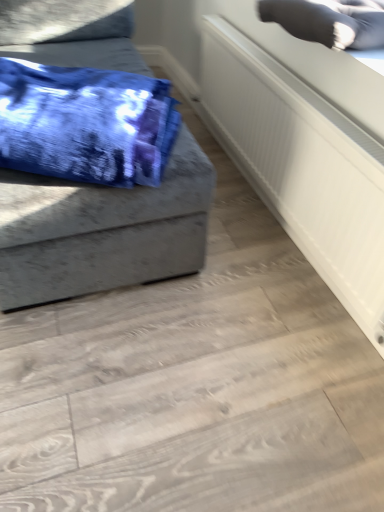
Question: Can you confirm if gray fabric pillow at upper right is bigger than white textured radiator at upper right?

Choices:
 (A) no
 (B) yes

Answer: (B)

Question: Considering the relative sizes of gray fabric pillow at upper right and white textured radiator at upper right in the image provided, is gray fabric pillow at upper right taller than white textured radiator at upper right?

Choices:
 (A) no
 (B) yes

Answer: (A)

Question: Can you confirm if gray fabric pillow at upper right is smaller than white textured radiator at upper right?

Choices:
 (A) no
 (B) yes

Answer: (A)

Question: From the image's perspective, would you say gray fabric pillow at upper right is positioned over white textured radiator at upper right?

Choices:
 (A) yes
 (B) no

Answer: (A)

Question: Is there a large distance between gray fabric pillow at upper right and white textured radiator at upper right?

Choices:
 (A) yes
 (B) no

Answer: (B)

Question: Is white textured radiator at upper right inside the boundaries of gray fabric pillow at upper right, or outside?

Choices:
 (A) outside
 (B) inside

Answer: (A)

Question: Is point (299, 147) positioned closer to the camera than point (286, 28)?

Choices:
 (A) farther
 (B) closer

Answer: (B)

Question: Visually, is white textured radiator at upper right positioned to the left or to the right of gray fabric pillow at upper right?

Choices:
 (A) right
 (B) left

Answer: (B)

Question: In terms of width, does white textured radiator at upper right look wider or thinner when compared to gray fabric pillow at upper right?

Choices:
 (A) wide
 (B) thin

Answer: (B)

Question: In the image, is gray fabric pillow at upper right on the left side or the right side of blue tie-dye fabric at left?

Choices:
 (A) right
 (B) left

Answer: (A)

Question: Is gray fabric pillow at upper right in front of or behind blue tie-dye fabric at left in the image?

Choices:
 (A) front
 (B) behind

Answer: (B)

Question: Is gray fabric pillow at upper right taller or shorter than blue tie-dye fabric at left?

Choices:
 (A) tall
 (B) short

Answer: (B)

Question: In terms of width, does gray fabric pillow at upper right look wider or thinner when compared to blue tie-dye fabric at left?

Choices:
 (A) wide
 (B) thin

Answer: (B)

Question: Would you say blue tie-dye fabric at left is inside or outside gray fabric pillow at upper right?

Choices:
 (A) outside
 (B) inside

Answer: (A)

Question: From a real-world perspective, is blue tie-dye fabric at left positioned above or below gray fabric pillow at upper right?

Choices:
 (A) below
 (B) above

Answer: (A)